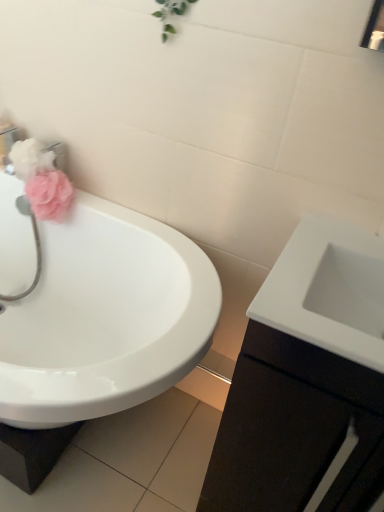
Question: Considering the relative sizes of white glossy cabinet at right and white glossy sink at right, the first sink when ordered from right to left, in the image provided, is white glossy cabinet at right wider than white glossy sink at right, the first sink when ordered from right to left,?

Choices:
 (A) no
 (B) yes

Answer: (B)

Question: Is white glossy cabinet at right next to white glossy sink at right, the second sink in the left-to-right sequence, and touching it?

Choices:
 (A) yes
 (B) no

Answer: (B)

Question: From the image's perspective, is white glossy cabinet at right on top of white glossy sink at right, the second sink in the left-to-right sequence?

Choices:
 (A) no
 (B) yes

Answer: (A)

Question: Does white glossy cabinet at right appear on the left side of white glossy sink at right, the first sink when ordered from right to left?

Choices:
 (A) no
 (B) yes

Answer: (A)

Question: Is the position of white glossy cabinet at right less distant than that of white glossy sink at right, the second sink in the left-to-right sequence?

Choices:
 (A) yes
 (B) no

Answer: (A)

Question: Is point (46, 179) positioned closer to the camera than point (36, 146)?

Choices:
 (A) farther
 (B) closer

Answer: (B)

Question: From a real-world perspective, is matte pink sponge at left, which ranks as the 1th flower in bottom-to-top order, physically located above or below matte pink flower at left, the 1th flower from the top?

Choices:
 (A) below
 (B) above

Answer: (A)

Question: In the image, is matte pink sponge at left, which ranks as the 1th flower in bottom-to-top order, on the left side or the right side of matte pink flower at left, positioned as the second flower in bottom-to-top order?

Choices:
 (A) right
 (B) left

Answer: (A)

Question: Is matte pink sponge at left, which ranks as the 1th flower in bottom-to-top order, inside or outside of matte pink flower at left, positioned as the second flower in bottom-to-top order?

Choices:
 (A) inside
 (B) outside

Answer: (B)

Question: From the image's perspective, is white glossy sink at left, the second sink in the right-to-left sequence, above or below white glossy cabinet at right?

Choices:
 (A) below
 (B) above

Answer: (B)

Question: Is white glossy sink at left, the second sink in the right-to-left sequence, wider or thinner than white glossy cabinet at right?

Choices:
 (A) thin
 (B) wide

Answer: (B)

Question: Is white glossy sink at left, marked as the first sink in a left-to-right arrangement, bigger or smaller than white glossy cabinet at right?

Choices:
 (A) small
 (B) big

Answer: (B)

Question: From a real-world perspective, is white glossy sink at left, marked as the first sink in a left-to-right arrangement, above or below white glossy cabinet at right?

Choices:
 (A) above
 (B) below

Answer: (B)

Question: From the image's perspective, is white glossy sink at right, the first sink when ordered from right to left, located above or below matte pink flower at left, positioned as the second flower in bottom-to-top order?

Choices:
 (A) above
 (B) below

Answer: (B)

Question: From their relative heights in the image, would you say white glossy sink at right, the first sink when ordered from right to left, is taller or shorter than matte pink flower at left, the 1th flower from the top?

Choices:
 (A) tall
 (B) short

Answer: (A)